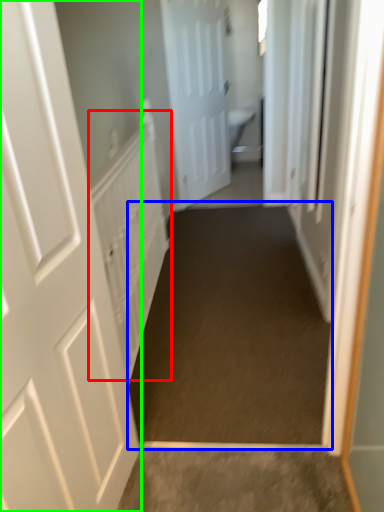
Question: Which object is positioned closest to radiator (highlighted by a red box)? Select from path (highlighted by a blue box) and door (highlighted by a green box).

Choices:
 (A) path
 (B) door

Answer: (A)